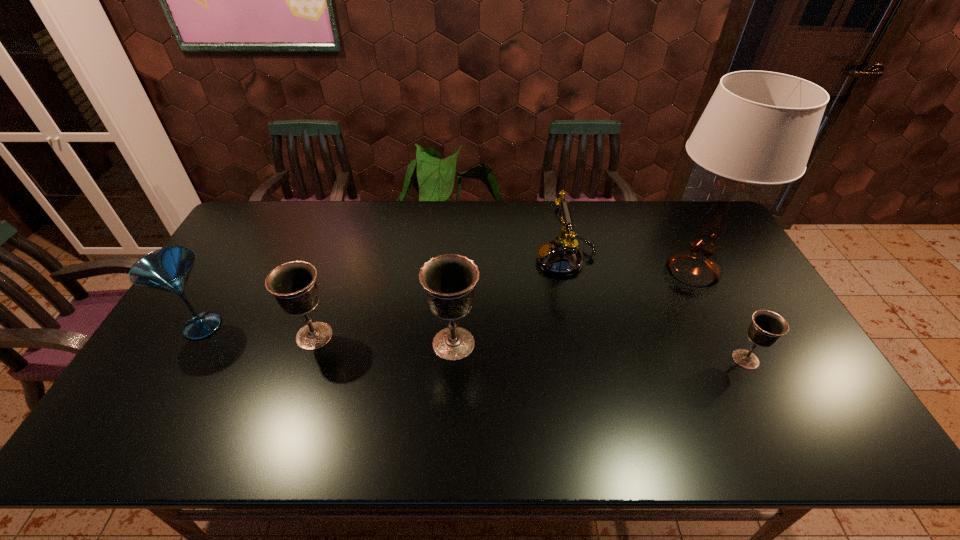
This screenshot has height=540, width=960. I want to click on vacant point that satisfies the following two spatial constraints: 1. on the front side of the martini; 2. on the left side of the third object from left to right, so click(x=192, y=343).

Find the location of a particular element. free spot that satisfies the following two spatial constraints: 1. on the dial of the third object from right to left; 2. on the back side of the shortest chalice is located at coordinates (587, 359).